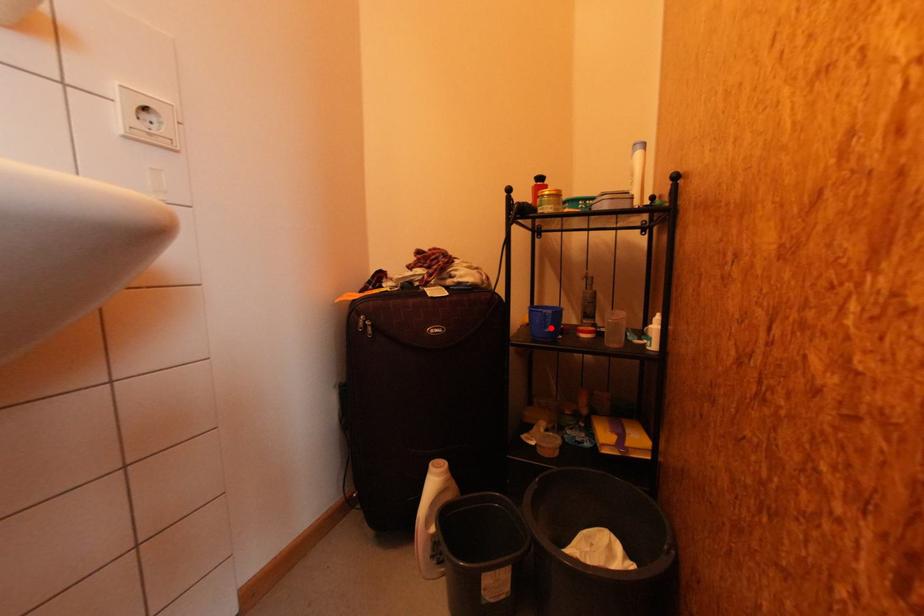
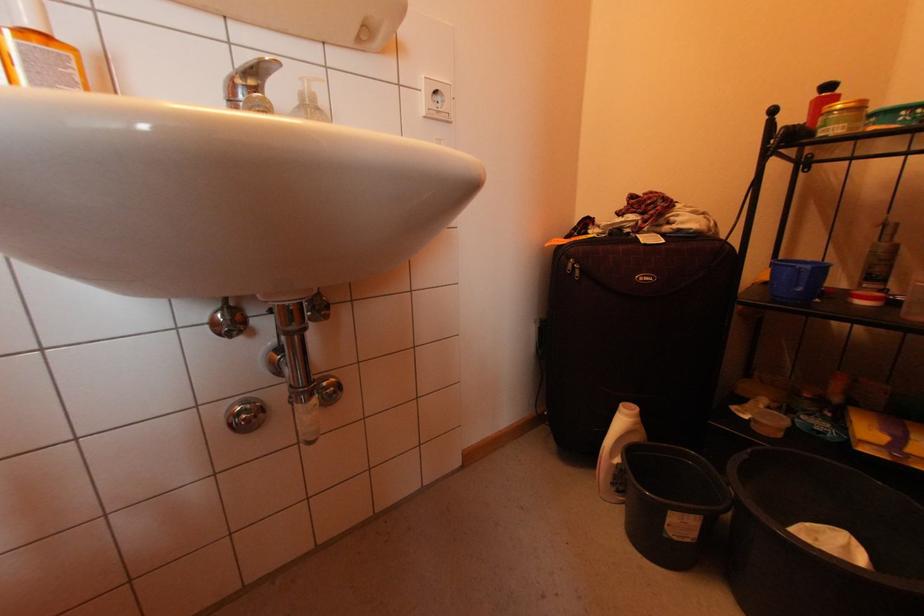
The point at the highlighted location is marked in the first image. Where is the corresponding point in the second image?

(803, 286)